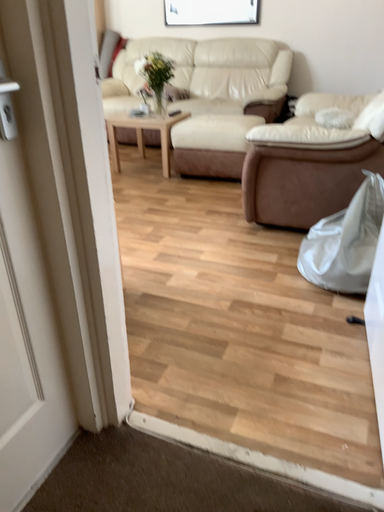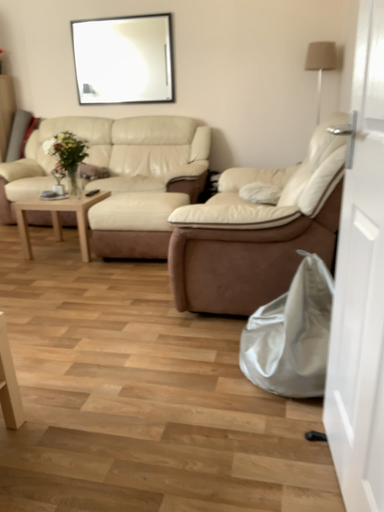
Question: How did the camera likely rotate when shooting the video?

Choices:
 (A) rotated upward
 (B) rotated downward

Answer: (A)